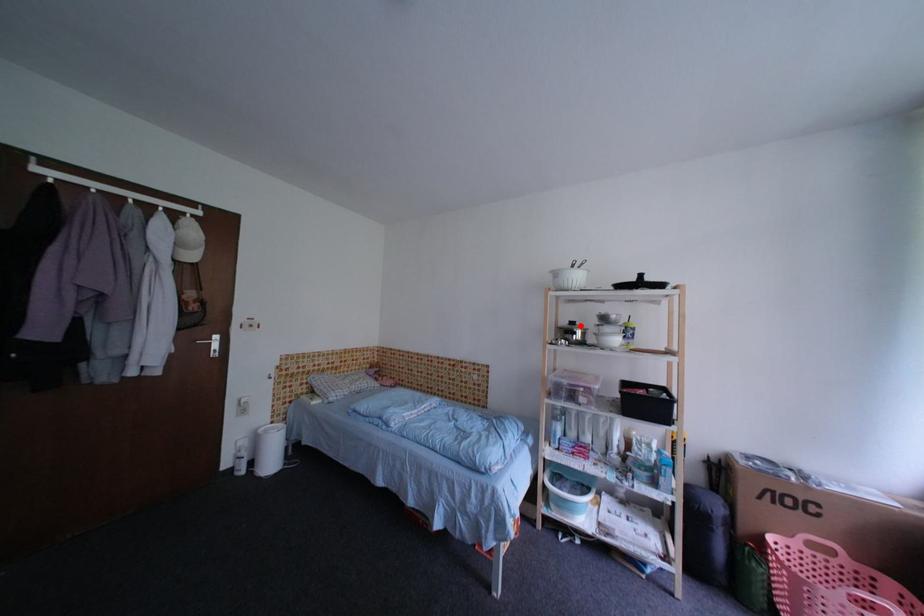
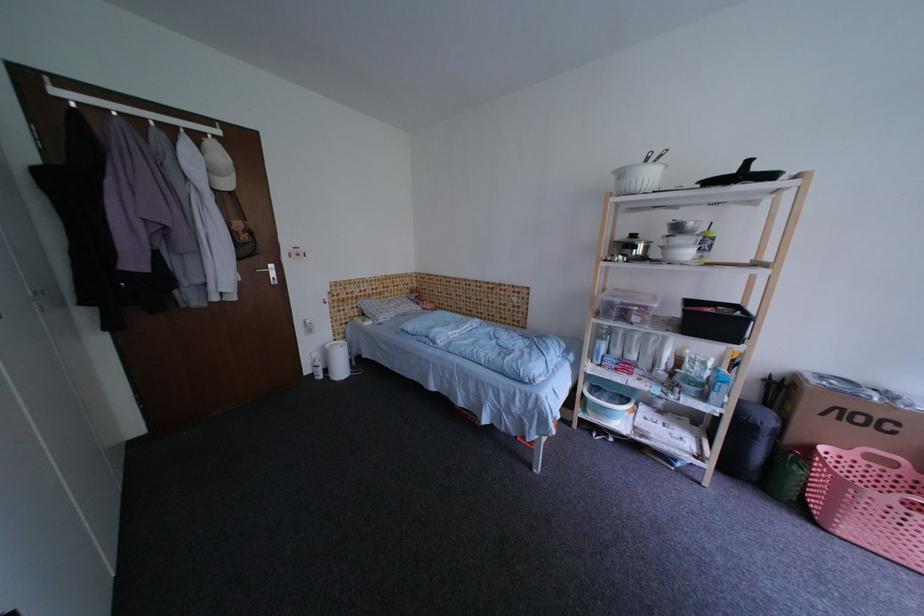
The point at the highlighted location is marked in the first image. Where is the corresponding point in the second image?

(641, 238)